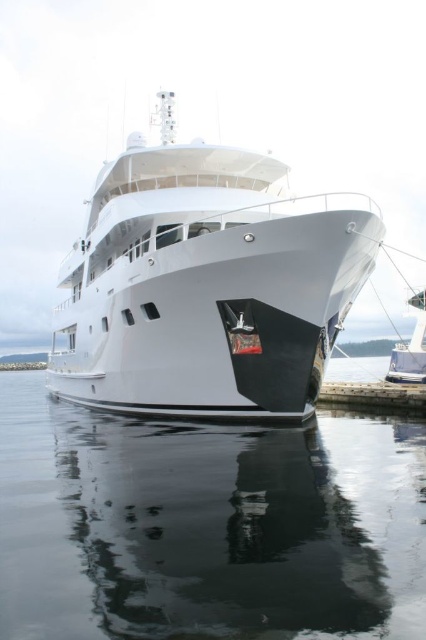
Question: Can you confirm if white glossy yacht at center is positioned above white glossy yacht at right?

Choices:
 (A) yes
 (B) no

Answer: (A)

Question: Is white glossy yacht at center bigger than white glossy yacht at right?

Choices:
 (A) yes
 (B) no

Answer: (A)

Question: Is white glossy yacht at center further to the viewer compared to white glossy yacht at right?

Choices:
 (A) yes
 (B) no

Answer: (B)

Question: Which point is closer to the camera taking this photo?

Choices:
 (A) (103, 528)
 (B) (394, 364)
 (C) (357, 257)

Answer: (A)

Question: Which object appears closest to the camera in this image?

Choices:
 (A) transparent water at lower center
 (B) white glossy yacht at center
 (C) white glossy yacht at right

Answer: (A)

Question: Which of the following is the closest to the observer?

Choices:
 (A) (55, 548)
 (B) (307, 230)

Answer: (A)